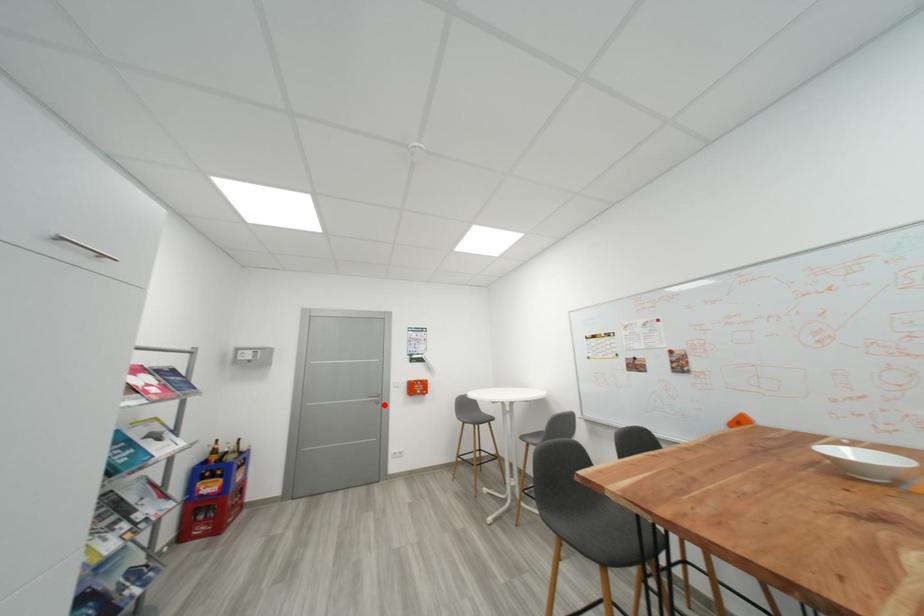
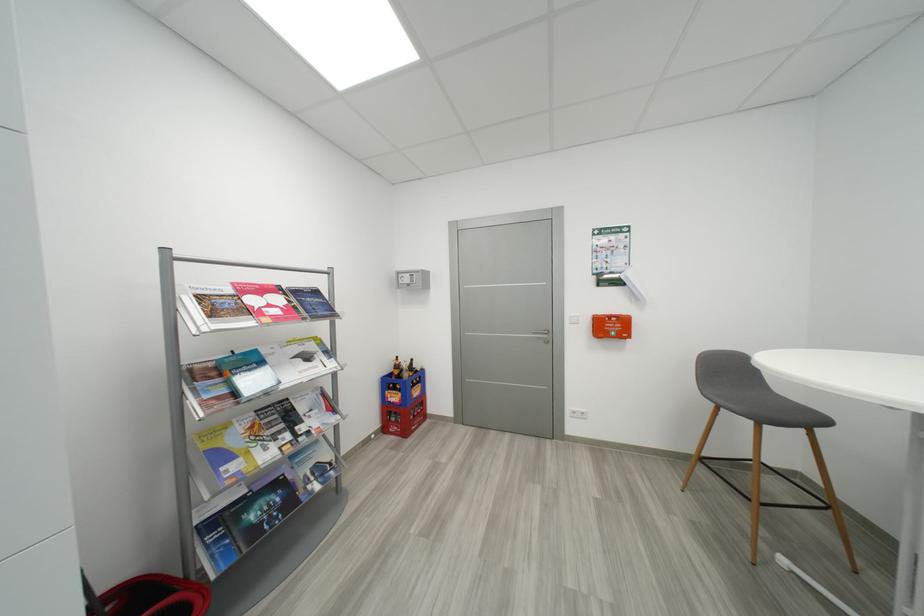
Find the pixel in the second image that matches the highlighted location in the first image.

(553, 344)